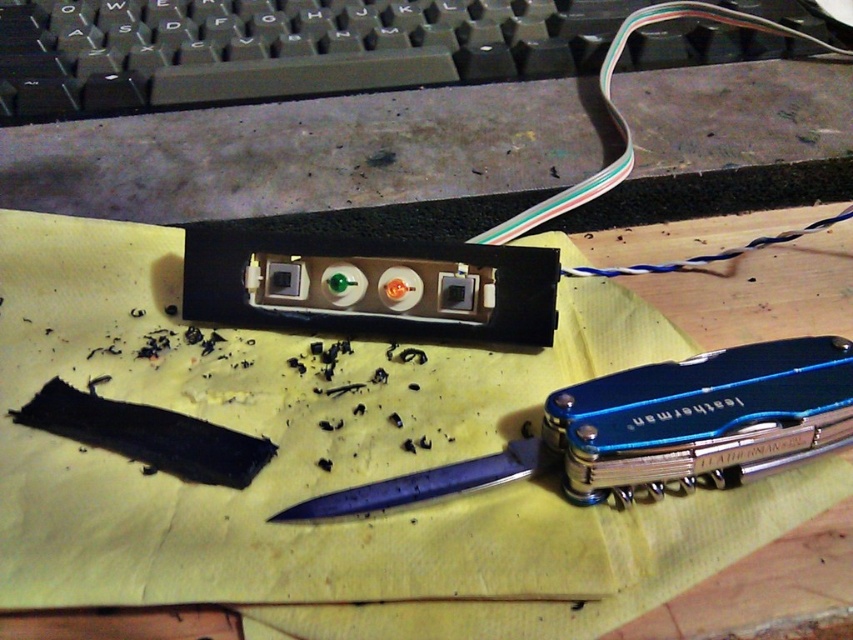
You are organizing a desk and need to place the black plastic keyboard at upper center and the blue metallic pocketknife at lower center. The desk has a maximum allowable distance of 24 inches between items for ergonomic reach. Will the current placement of these items meet the ergonomic requirement?

The black plastic keyboard at upper center and blue metallic pocketknife at lower center are 24.75 inches apart from each other, which exceeds the 24 inch maximum distance for ergonomic reach. Therefore, the current placement does not meet the ergonomic requirement.